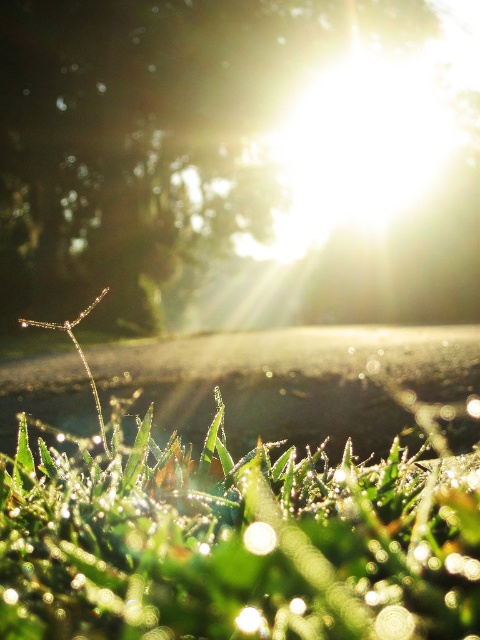
Question: From the image, what is the correct spatial relationship of green leafy tree at upper center in relation to glistening green grass at lower center?

Choices:
 (A) left
 (B) right

Answer: (B)

Question: Among these points, which one is farthest from the camera?

Choices:
 (A) (8, 104)
 (B) (80, 605)

Answer: (A)

Question: Where is green leafy tree at upper center located in relation to glistening green grass at lower center in the image?

Choices:
 (A) left
 (B) right

Answer: (B)

Question: Is green leafy tree at upper center bigger than glistening green grass at lower center?

Choices:
 (A) no
 (B) yes

Answer: (B)

Question: Which object appears farthest from the camera in this image?

Choices:
 (A) glistening green grass at lower center
 (B) green leafy tree at upper center

Answer: (B)